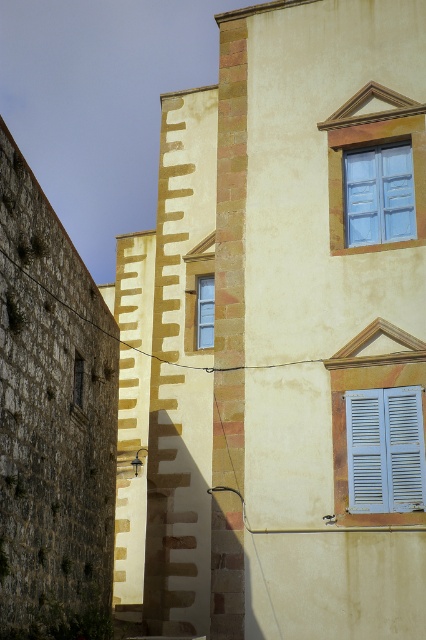
Between white painted wood shutters at right and blue painted wood window at upper right, which one is positioned lower?

white painted wood shutters at right is below.

Who is positioned more to the left, white painted wood shutters at right or blue painted wood window at upper right?

Positioned to the left is white painted wood shutters at right.

Is point (371, 403) behind point (408, 166)?

No.

Where is `white painted wood shutters at right`? This screenshot has height=640, width=426. white painted wood shutters at right is located at coordinates (385, 449).

How distant is matte glass window at center from dark brown wooden window at left?

They are 3.92 meters apart.

Who is positioned more to the right, matte glass window at center or dark brown wooden window at left?

From the viewer's perspective, matte glass window at center appears more on the right side.

Where is `matte glass window at center`? matte glass window at center is located at coordinates (206, 310).

Does blue painted wood window at upper right appear on the right side of dark brown wooden window at left?

Yes, blue painted wood window at upper right is to the right of dark brown wooden window at left.

Between blue painted wood window at upper right and dark brown wooden window at left, which one appears on the right side from the viewer's perspective?

Positioned to the right is blue painted wood window at upper right.

Find the location of `blue painted wood window at upper right`. blue painted wood window at upper right is located at coordinates (379, 195).